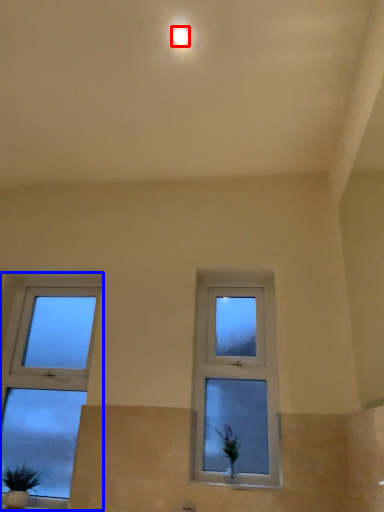
Question: Which object appears closest to the camera in this image, lighting (highlighted by a red box) or window (highlighted by a blue box)?

Choices:
 (A) lighting
 (B) window

Answer: (A)